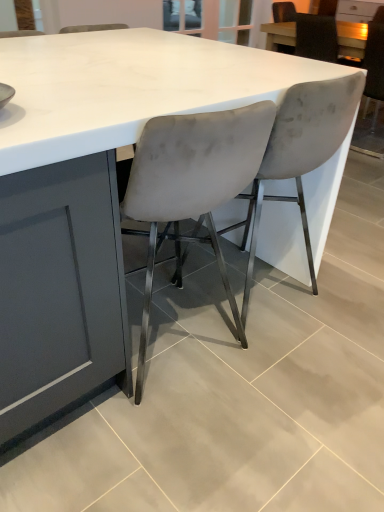
Question: From a real-world perspective, is velvet grey chair at center, the second chair viewed from the back, physically located above or below matte white table at upper right?

Choices:
 (A) above
 (B) below

Answer: (B)

Question: Considering the positions of velvet grey chair at center, the second chair viewed from the back, and matte white table at upper right in the image, is velvet grey chair at center, the second chair viewed from the back, wider or thinner than matte white table at upper right?

Choices:
 (A) wide
 (B) thin

Answer: (B)

Question: Estimate the real-world distances between objects in this image. Which object is farther from the matte white table at upper right?

Choices:
 (A) velvet grey chair at center, which appears as the third chair when viewed from the back
 (B) velvet grey chair at center, which appears as the second chair when viewed from the front
 (C) velvet gray chair at upper right, which is the third chair from front to back

Answer: (A)

Question: Which is nearer to the matte white table at upper right?

Choices:
 (A) velvet grey chair at center, which appears as the third chair when viewed from the back
 (B) velvet gray chair at upper right, the first chair in the back-to-front sequence
 (C) velvet grey chair at center, which is counted as the second chair, starting from the right

Answer: (B)